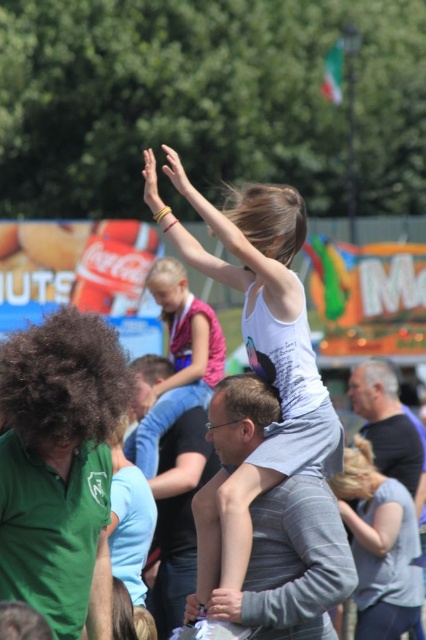
You are standing at the viewpoint of the image and want to know if the point at coordinates point (178, 291) is closer to you than the point at coordinates point (420, 456). Based on the scene description, can you determine which point is closer?

According to the description, point (178, 291) is behind point (420, 456), so the point at (420, 456) is closer to you.

You are organizing a clothing donation drive and need to determine which items are suitable for different age groups. Given the scene, which item, the pink fabric dress at upper center or the dark gray shirt at upper right, would you recommend for a toddler? Explain your reasoning based on their sizes.

The pink fabric dress at upper center has a larger size compared to the dark gray shirt at upper right. Therefore, the dark gray shirt at upper right is smaller and more suitable for a toddler.